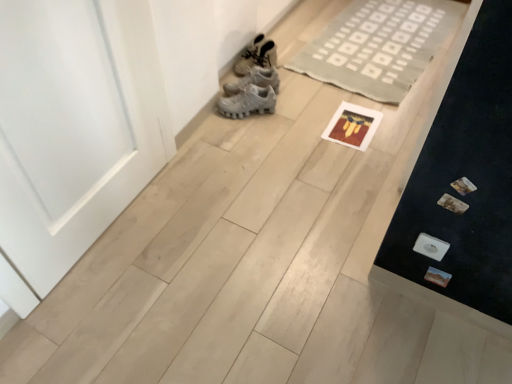
The width and height of the screenshot is (512, 384). I want to click on white matte sneakers at upper center, so click(x=257, y=55).

From a real-world perspective, relative to white matte sneakers at upper center, is white matte door at left vertically above or below?

Clearly, from a real-world perspective, white matte door at left is above white matte sneakers at upper center.

From the image's perspective, is white matte door at left above or below white matte sneakers at upper center?

Clearly, from the image's perspective, white matte door at left is below white matte sneakers at upper center.

Is white matte door at left in front of or behind white matte sneakers at upper center in the image?

white matte door at left is positioned closer to the viewer than white matte sneakers at upper center.

Between white matte door at left and white matte sneakers at upper center, which one has larger width?

Wider between the two is white matte sneakers at upper center.

Considering the relative sizes of neutral woven rug at upper center and white matte sneakers at upper center in the image provided, is neutral woven rug at upper center shorter than white matte sneakers at upper center?

Yes, neutral woven rug at upper center is shorter than white matte sneakers at upper center.

Is neutral woven rug at upper center with white matte sneakers at upper center?

neutral woven rug at upper center and white matte sneakers at upper center are not in contact.

From the image's perspective, relative to white matte sneakers at upper center, is neutral woven rug at upper center above or below?

From the image's perspective, neutral woven rug at upper center appears above white matte sneakers at upper center.

Is neutral woven rug at upper center facing away from white matte sneakers at upper center?

neutral woven rug at upper center does not have its back to white matte sneakers at upper center.

From a real-world perspective, between white matte door at left and neutral woven rug at upper center, who is vertically higher?

white matte door at left, from a real-world perspective.

From the image's perspective, between white matte door at left and neutral woven rug at upper center, who is located below?

From the image's view, white matte door at left is below.

Considering the sizes of objects white matte door at left and neutral woven rug at upper center in the image provided, who is smaller, white matte door at left or neutral woven rug at upper center?

neutral woven rug at upper center is smaller.

Does white matte sneakers at upper center appear on the left side of neutral woven rug at upper center?

Correct, you'll find white matte sneakers at upper center to the left of neutral woven rug at upper center.

How far apart are white matte sneakers at upper center and neutral woven rug at upper center?

They are 56.24 centimeters apart.

From the picture: Which object is thinner, white matte sneakers at upper center or neutral woven rug at upper center?

white matte sneakers at upper center.

From a real-world perspective, is white matte sneakers at upper center located beneath neutral woven rug at upper center?

No, from a real-world perspective, white matte sneakers at upper center is not beneath neutral woven rug at upper center.

Looking at this image, considering the relative positions of white matte sneakers at upper center and white matte door at left in the image provided, is white matte sneakers at upper center to the left of white matte door at left from the viewer's perspective?

Incorrect, white matte sneakers at upper center is not on the left side of white matte door at left.

How different are the orientations of white matte sneakers at upper center and white matte door at left in degrees?

white matte sneakers at upper center and white matte door at left are facing 0.201 degrees away from each other.

Which is in front, white matte sneakers at upper center or white matte door at left?

white matte door at left is closer to the camera.

From the picture: Could you tell me if white matte sneakers at upper center is turned towards white matte door at left?

No, white matte sneakers at upper center is not turned towards white matte door at left.

Is point (399, 15) positioned before point (96, 139)?

That is False.

Considering the sizes of neutral woven rug at upper center and white matte door at left in the image, is neutral woven rug at upper center taller or shorter than white matte door at left?

Considering their sizes, neutral woven rug at upper center has less height than white matte door at left.

How distant is neutral woven rug at upper center from white matte door at left?

4.60 feet.

This screenshot has height=384, width=512. In order to click on footwear located on the right of white matte door at left in this screenshot , I will do `click(257, 55)`.

Locate an element on the screen. footwear behind the neutral woven rug at upper center is located at coordinates (257, 55).

Which object lies further to the anchor point white matte door at left, white matte sneakers at upper center or neutral woven rug at upper center?

neutral woven rug at upper center lies further to white matte door at left than the other object.

Looking at the image, which one is located further to white matte sneakers at upper center, white matte door at left or neutral woven rug at upper center?

white matte door at left is positioned further to the anchor white matte sneakers at upper center.

Looking at the image, which one is located closer to white matte door at left, neutral woven rug at upper center or white matte sneakers at upper center?

white matte sneakers at upper center lies closer to white matte door at left than the other object.

Considering their positions, is white matte door at left positioned further to neutral woven rug at upper center than white matte sneakers at upper center?

Based on the image, white matte door at left appears to be further to neutral woven rug at upper center.

Which object lies nearer to the anchor point white matte sneakers at upper center, neutral woven rug at upper center or white matte door at left?

neutral woven rug at upper center is closer to white matte sneakers at upper center.

Estimate the real-world distances between objects in this image. Which object is further from neutral woven rug at upper center, white matte sneakers at upper center or white matte door at left?

white matte door at left is further to neutral woven rug at upper center.

The width and height of the screenshot is (512, 384). Find the location of `doormat located between white matte door at left and white matte sneakers at upper center in the depth direction`. doormat located between white matte door at left and white matte sneakers at upper center in the depth direction is located at coordinates (379, 46).